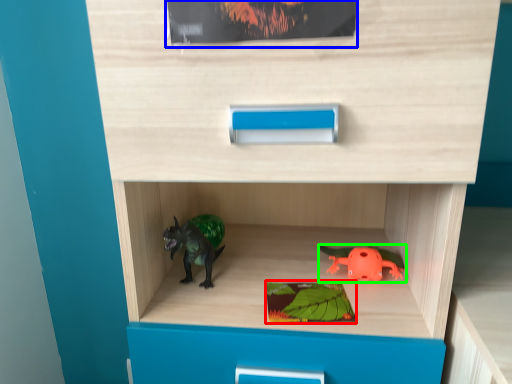
Question: Considering the real-world distances, which object is closest to paperback book (highlighted by a red box)? paperback book (highlighted by a blue box) or toy (highlighted by a green box).

Choices:
 (A) paperback book
 (B) toy

Answer: (B)